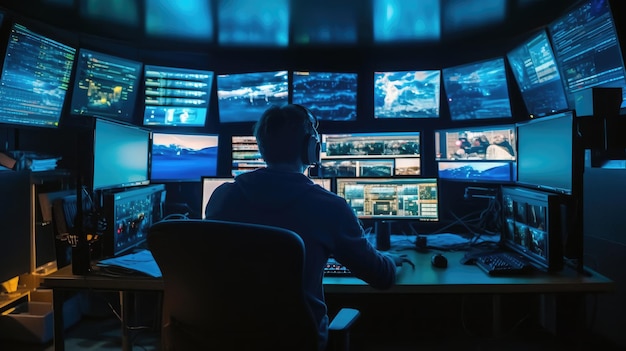
Identify the location of shadows of computer monitors on ceiling. This screenshot has height=351, width=626. (118, 11), (178, 19), (252, 23), (321, 23), (408, 19), (478, 10).